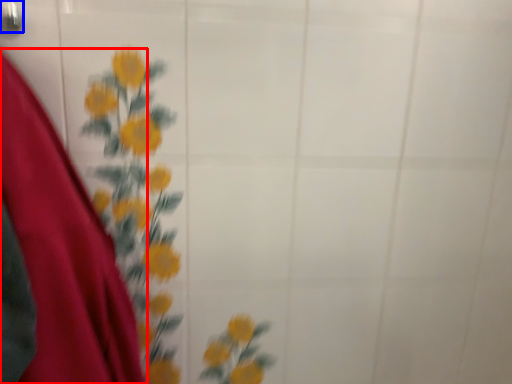
Question: Which of the following is the closest to the observer, dress (highlighted by a red box) or door handle (highlighted by a blue box)?

Choices:
 (A) dress
 (B) door handle

Answer: (A)